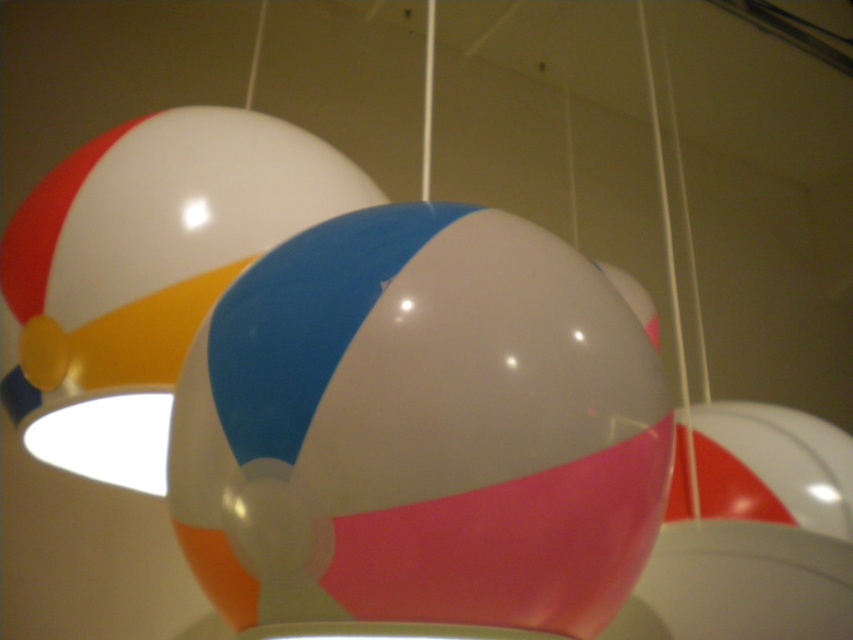
Is glossy plastic ball at center further to camera compared to shiny plastic ball at center?

No, glossy plastic ball at center is closer to the viewer.

Which is behind, point (379, 506) or point (132, 195)?

The point (132, 195) is more distant.

Where is `glossy plastic ball at center`? The image size is (853, 640). glossy plastic ball at center is located at coordinates (421, 429).